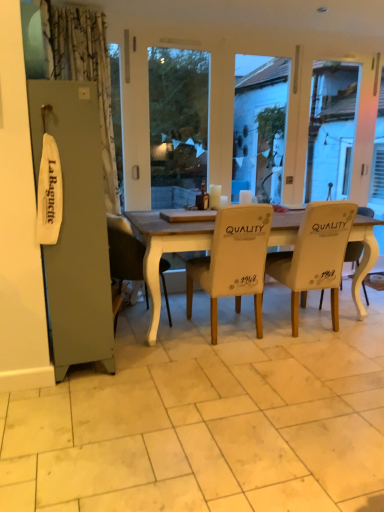
Find the location of `vacant area that is in front of white fabric chair at center, acting as the 1th chair starting from the left`. vacant area that is in front of white fabric chair at center, acting as the 1th chair starting from the left is located at coordinates (153, 354).